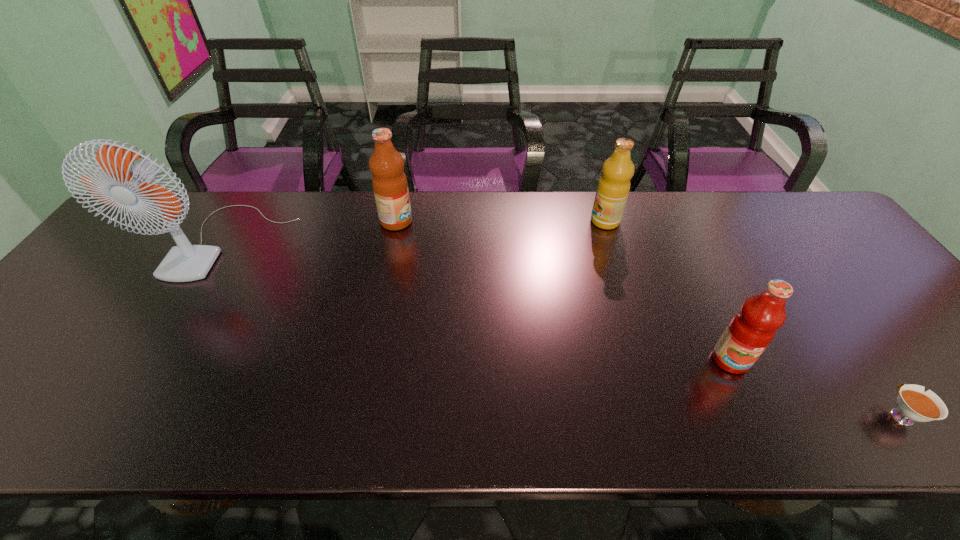
The image size is (960, 540). Identify the location of the tallest object. (185, 262).

You are a GUI agent. You are given a task and a screenshot of the screen. Output one action in this format:
    pyautogui.click(x=<x>, y=<y>)
    Task: Click on the fan
    Image resolution: width=960 pixels, height=540 pixels.
    Given the screenshot: What is the action you would take?
    pyautogui.click(x=185, y=262)

Locate an element on the screen. Image resolution: width=960 pixels, height=540 pixels. the leftmost fruit juice is located at coordinates click(x=389, y=182).

I want to click on the third object from left to right, so pos(613,188).

Locate an element on the screen. This screenshot has height=540, width=960. the rightmost fruit juice is located at coordinates (751, 330).

The width and height of the screenshot is (960, 540). What are the coordinates of `the nearest fruit juice` in the screenshot? It's located at (751, 330).

Find the location of a particular element. This screenshot has height=540, width=960. teacup is located at coordinates (914, 404).

The image size is (960, 540). I want to click on the shortest object, so coord(914,404).

The height and width of the screenshot is (540, 960). In order to click on vacant space situated 0.270m on the front-facing side of the tallest object in this screenshot , I will do `click(147, 373)`.

Image resolution: width=960 pixels, height=540 pixels. Find the location of `free space located on the front label of the second object from left to right`. free space located on the front label of the second object from left to right is located at coordinates (475, 221).